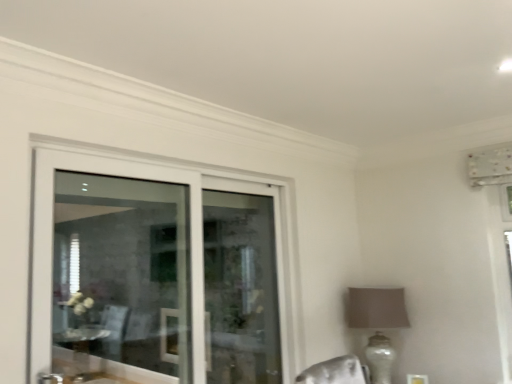
Question: From a real-world perspective, is matte beige lampshade at right under clear glass door at upper left?

Choices:
 (A) yes
 (B) no

Answer: (A)

Question: Is matte beige lampshade at right facing towards clear glass door at upper left?

Choices:
 (A) yes
 (B) no

Answer: (A)

Question: Considering the relative sizes of matte beige lampshade at right and clear glass door at upper left in the image provided, is matte beige lampshade at right taller than clear glass door at upper left?

Choices:
 (A) no
 (B) yes

Answer: (A)

Question: Would you say matte beige lampshade at right is outside clear glass door at upper left?

Choices:
 (A) yes
 (B) no

Answer: (A)

Question: Considering the relative positions of matte beige lampshade at right and clear glass door at upper left in the image provided, is matte beige lampshade at right in front of clear glass door at upper left?

Choices:
 (A) yes
 (B) no

Answer: (B)

Question: From the image's perspective, is matte beige lampshade at right beneath clear glass door at upper left?

Choices:
 (A) no
 (B) yes

Answer: (B)

Question: Is clear glass door at upper left positioned beyond the bounds of matte beige lampshade at right?

Choices:
 (A) yes
 (B) no

Answer: (A)

Question: From a real-world perspective, does clear glass door at upper left stand above matte beige lampshade at right?

Choices:
 (A) yes
 (B) no

Answer: (A)

Question: Considering the relative sizes of clear glass door at upper left and matte beige lampshade at right in the image provided, is clear glass door at upper left smaller than matte beige lampshade at right?

Choices:
 (A) yes
 (B) no

Answer: (B)

Question: Can you confirm if clear glass door at upper left is shorter than matte beige lampshade at right?

Choices:
 (A) yes
 (B) no

Answer: (B)

Question: From the image's perspective, is clear glass door at upper left on top of matte beige lampshade at right?

Choices:
 (A) yes
 (B) no

Answer: (A)

Question: Is matte beige lampshade at right completely or partially inside clear glass door at upper left?

Choices:
 (A) yes
 (B) no

Answer: (B)

Question: Based on their sizes in the image, would you say matte beige lampshade at right is bigger or smaller than clear glass door at upper left?

Choices:
 (A) small
 (B) big

Answer: (A)